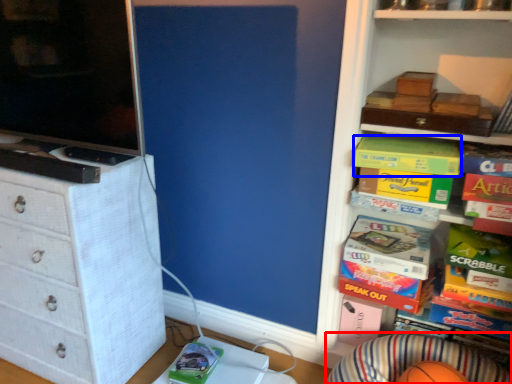
Question: Which object is closer to the camera taking this photo, plain (highlighted by a red box) or book (highlighted by a blue box)?

Choices:
 (A) plain
 (B) book

Answer: (A)